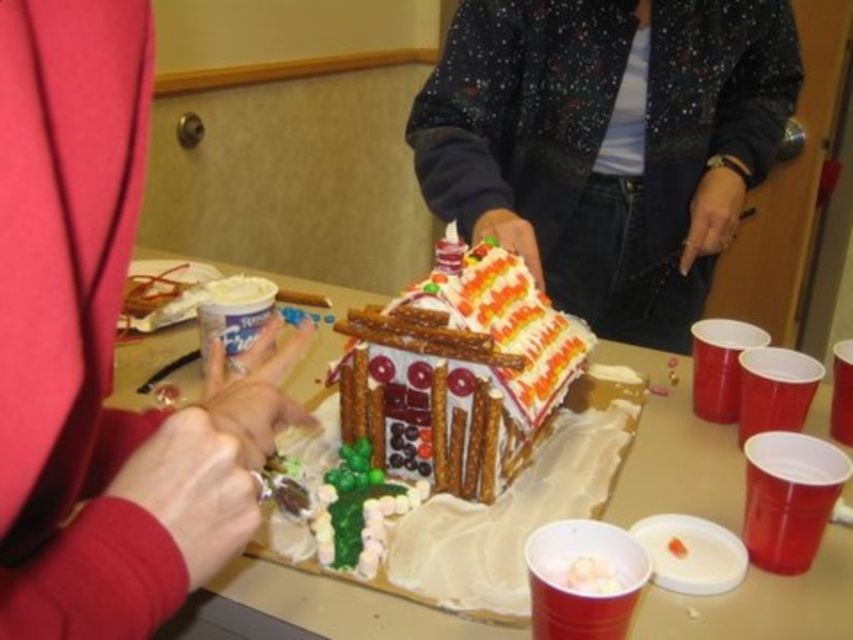
Who is taller, matte red sweater at upper left or white fondant gingerbread house at center?

matte red sweater at upper left is taller.

Who is more forward, (111, 61) or (299, 577)?

Point (111, 61)

Where is `matte red sweater at upper left`? matte red sweater at upper left is located at coordinates (102, 349).

Does point (183, 392) lie behind point (561, 378)?

That is True.

Consider the image. Between white fondant gingerbread house at center and decorative gingerbread house at center, which one is positioned higher?

decorative gingerbread house at center

Image resolution: width=853 pixels, height=640 pixels. I want to click on white fondant gingerbread house at center, so click(x=674, y=451).

Where is `white fondant gingerbread house at center`? The image size is (853, 640). white fondant gingerbread house at center is located at coordinates (674, 451).

Looking at this image, can you confirm if speckled fabric jacket at center is bigger than white fondant gingerbread house at center?

Indeed, speckled fabric jacket at center has a larger size compared to white fondant gingerbread house at center.

From the picture: Between speckled fabric jacket at center and white fondant gingerbread house at center, which one has less height?

With less height is white fondant gingerbread house at center.

Is point (671, 321) positioned after point (734, 609)?

Yes.

Find the location of a particular element. speckled fabric jacket at center is located at coordinates (607, 144).